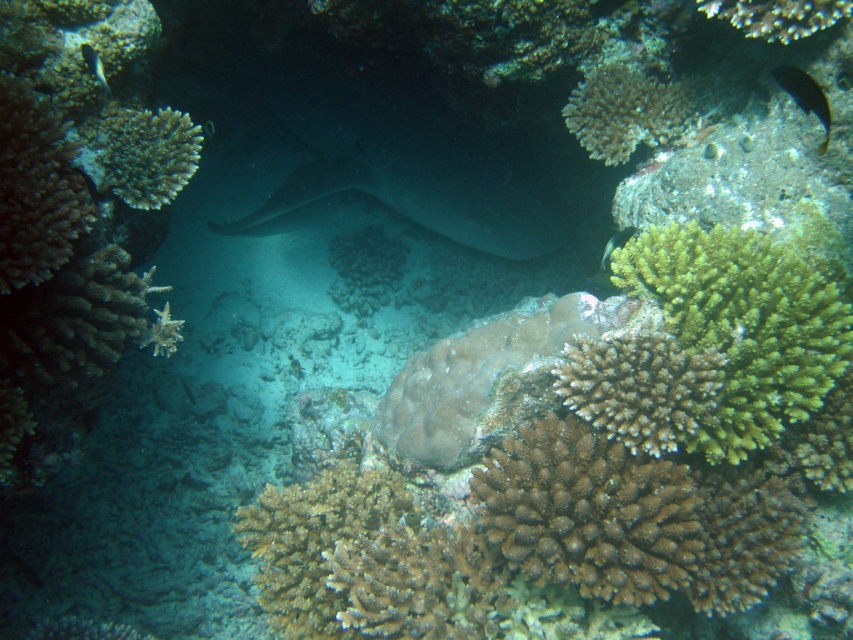
Is point (57, 168) closer to viewer compared to point (622, 236)?

Yes, point (57, 168) is in front of point (622, 236).

The image size is (853, 640). I want to click on brown coral at upper left, so click(36, 188).

Does brown coral at center come in front of brown porous coral at center?

No, brown coral at center is further to the viewer.

Between brown coral at center and brown porous coral at center, which one is positioned lower?

brown porous coral at center

Between point (263, 506) and point (709, 506), which one is positioned behind?

Positioned behind is point (263, 506).

The width and height of the screenshot is (853, 640). I want to click on brown coral at center, so [587, 452].

Which of these two, smooth gray stingray at center or green frondose coral at center, stands taller?

smooth gray stingray at center is taller.

Is point (386, 102) positioned after point (741, 358)?

Yes, it is behind point (741, 358).

This screenshot has height=640, width=853. In order to click on smooth gray stingray at center in this screenshot , I will do pyautogui.click(x=433, y=156).